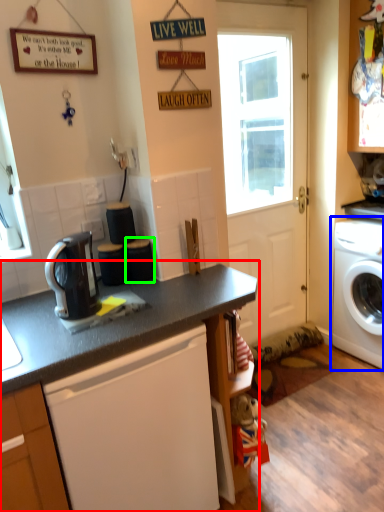
Question: Considering the real-world distances, which object is farthest from countertop (highlighted by a red box)? washing machine (highlighted by a blue box) or appliance (highlighted by a green box)?

Choices:
 (A) washing machine
 (B) appliance

Answer: (A)